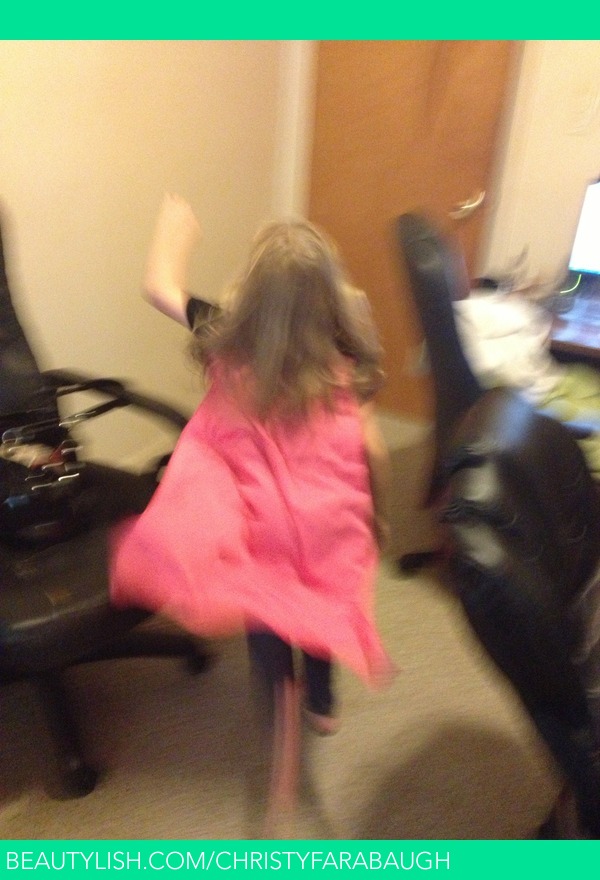
Locate an element on the screen. This screenshot has width=600, height=880. blurry tan door in background is located at coordinates (390, 132).